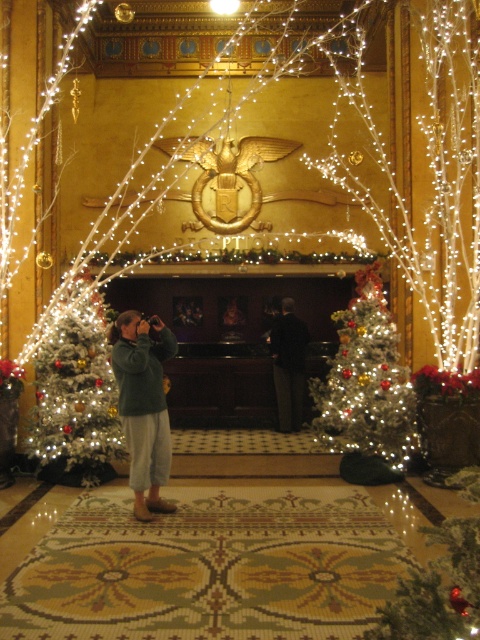
You are standing in the lobby and want to take a photo of both the white frosted christmas tree at left and the white frosted christmas tree at center without any obstructions. Is it possible to position yourself so that both trees are visible in the frame without one blocking the other?

The white frosted christmas tree at left is in front of the white frosted christmas tree at center, so positioning yourself so that both are visible without obstruction might be challenging. You may need to move to a side angle where the trees are not directly aligned.

You are a photographer standing in the lobby and want to take a picture of both the white frosted christmas tree at left and the white frosted christmas tree at center. Which tree should you focus on first if you want to capture the larger one in your frame?

The white frosted christmas tree at center is larger than the white frosted christmas tree at left, so you should focus on the white frosted christmas tree at center first to capture its larger size in your frame.